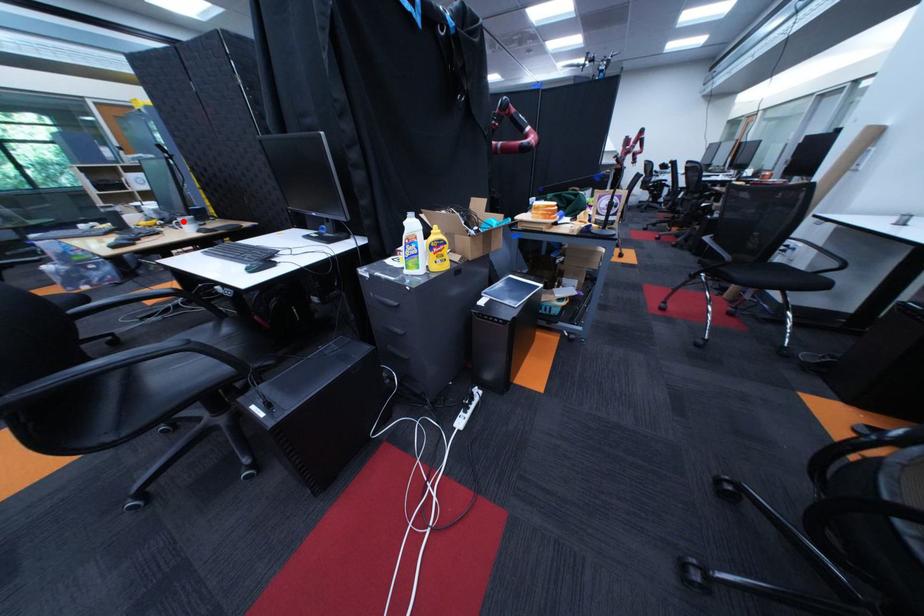
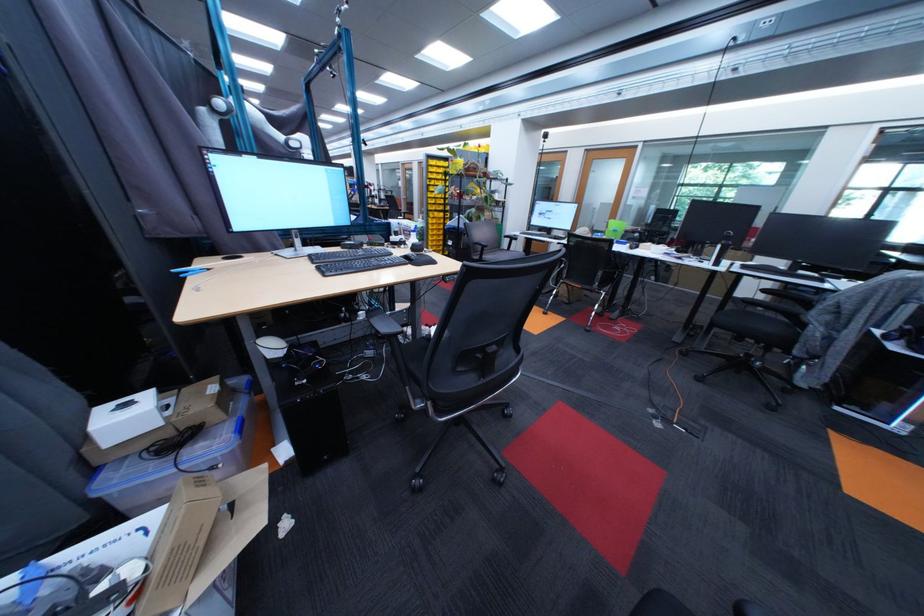
Question: I am providing you with two images of the same scene from different viewpoints. A red point is marked on the first image. Can you still see the location of the red point in image 2?

Choices:
 (A) Yes
 (B) No

Answer: (B)